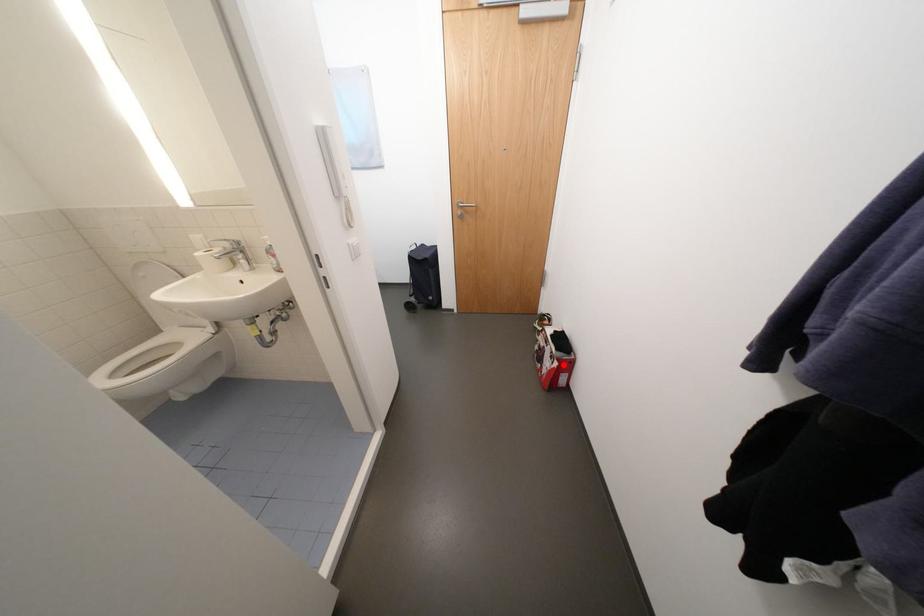
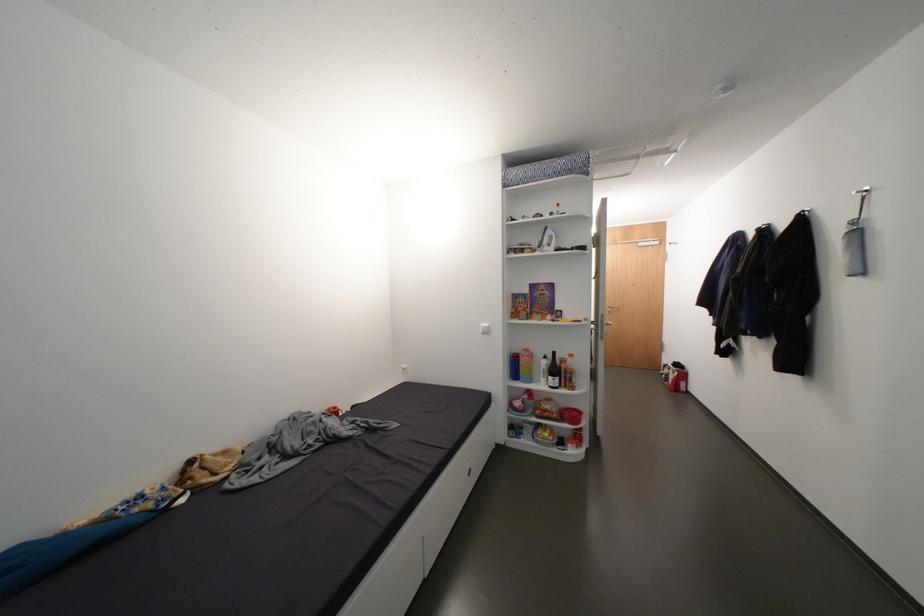
Question: A red point is marked in image1. In image2, is the corresponding 3D point closer to the camera or farther? Reply with the corresponding letter.

Choices:
 (A) The corresponding 3D point is closer.
 (B) The corresponding 3D point is farther.

Answer: (A)